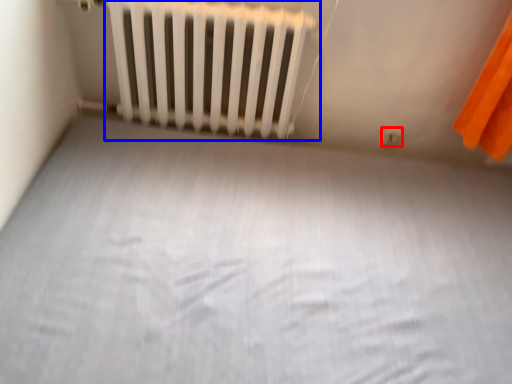
Question: Which of the following is the farthest to the observer, electric outlet (highlighted by a red box) or radiator (highlighted by a blue box)?

Choices:
 (A) electric outlet
 (B) radiator

Answer: (A)